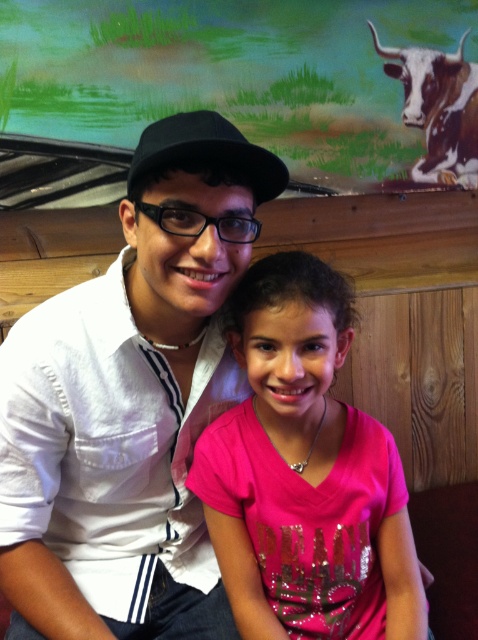
Is white matte shirt at center to the right of brown and white textured bull at upper right from the viewer's perspective?

In fact, white matte shirt at center is to the left of brown and white textured bull at upper right.

What do you see at coordinates (130, 403) in the screenshot? This screenshot has height=640, width=478. I see `white matte shirt at center` at bounding box center [130, 403].

Which is in front, point (127, 492) or point (470, 147)?

Positioned in front is point (127, 492).

Identify the location of white matte shirt at center. Image resolution: width=478 pixels, height=640 pixels. [x=130, y=403].

Who is positioned more to the right, pink shiny shirt at center or black matte baseball hat at upper center?

pink shiny shirt at center is more to the right.

Between point (333, 488) and point (140, 148), which one is positioned in front?

Point (140, 148) is more forward.

Between point (249, 424) and point (149, 157), which one is positioned in front?

Point (149, 157) is more forward.

This screenshot has width=478, height=640. What are the coordinates of `pink shiny shirt at center` in the screenshot? It's located at (304, 474).

Measure the distance between point (x=73, y=604) and camera.

Point (x=73, y=604) and camera are 35.06 inches apart from each other.

Is point (76, 611) farther from viewer compared to point (162, 128)?

Yes, it is.

Which is in front, point (50, 344) or point (171, 150)?

Point (171, 150)

This screenshot has height=640, width=478. What are the coordinates of `white matte shirt at center` in the screenshot? It's located at (130, 403).